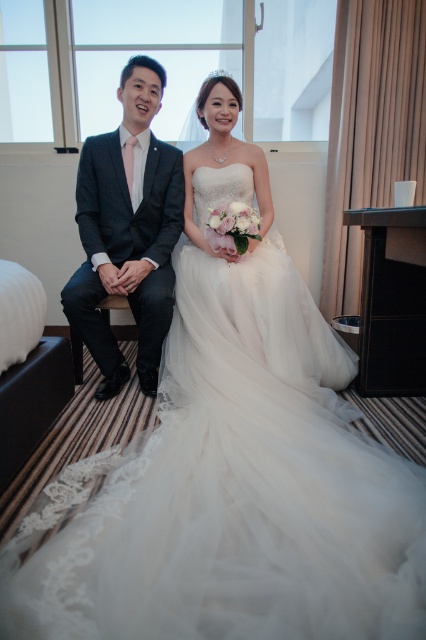
Does matte black suit at left have a lesser height compared to white lace dress at center?

Incorrect, matte black suit at left's height does not fall short of white lace dress at center's.

Between matte black suit at left and white lace dress at center, which one has less height?

white lace dress at center

Which is in front, point (124, 250) or point (245, 150)?

Point (124, 250) is more forward.

Identify the location of matte black suit at left. The height and width of the screenshot is (640, 426). (127, 230).

Is white tulle dress at center below matte black suit at left?

Indeed, white tulle dress at center is positioned under matte black suit at left.

Which is behind, point (278, 330) or point (89, 241)?

The point (89, 241) is more distant.

Is point (209, 417) in front of point (124, 86)?

That is True.

Where is `white tulle dress at center`? This screenshot has height=640, width=426. white tulle dress at center is located at coordinates (238, 490).

Image resolution: width=426 pixels, height=640 pixels. What do you see at coordinates (238, 490) in the screenshot?
I see `white tulle dress at center` at bounding box center [238, 490].

Identify the location of white tulle dress at center. The image size is (426, 640). (238, 490).